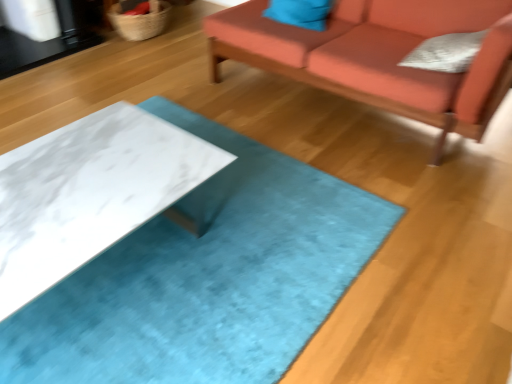
Question: Would you consider matte blue pillow at upper center, which is the second pillow from right to left, to be distant from velvet orange couch at upper right?

Choices:
 (A) no
 (B) yes

Answer: (A)

Question: From a real-world perspective, is matte blue pillow at upper center, which ranks as the first pillow in back-to-front order, under velvet orange couch at upper right?

Choices:
 (A) no
 (B) yes

Answer: (A)

Question: Is matte blue pillow at upper center, placed as the first pillow when sorted from top to bottom, in front of velvet orange couch at upper right?

Choices:
 (A) yes
 (B) no

Answer: (B)

Question: Is matte blue pillow at upper center, which ranks as the first pillow in back-to-front order, to the left of velvet orange couch at upper right from the viewer's perspective?

Choices:
 (A) yes
 (B) no

Answer: (A)

Question: Can you confirm if matte blue pillow at upper center, which is counted as the second pillow, starting from the bottom, is bigger than velvet orange couch at upper right?

Choices:
 (A) no
 (B) yes

Answer: (A)

Question: Considering the positions of point (479, 72) and point (22, 226), is point (479, 72) closer or farther from the camera than point (22, 226)?

Choices:
 (A) closer
 (B) farther

Answer: (B)

Question: Considering their positions, is velvet orange couch at upper right located in front of or behind white marble table at center?

Choices:
 (A) behind
 (B) front

Answer: (A)

Question: From a real-world perspective, relative to white marble table at center, is velvet orange couch at upper right vertically above or below?

Choices:
 (A) below
 (B) above

Answer: (B)

Question: Considering the positions of velvet orange couch at upper right and white marble table at center in the image, is velvet orange couch at upper right wider or thinner than white marble table at center?

Choices:
 (A) thin
 (B) wide

Answer: (A)

Question: Would you say white textured pillow at upper right, which ranks as the 2th pillow in top-to-bottom order, is to the left or to the right of white marble table at center in the picture?

Choices:
 (A) left
 (B) right

Answer: (B)

Question: From a real-world perspective, is white textured pillow at upper right, the 2th pillow positioned from the left, positioned above or below white marble table at center?

Choices:
 (A) below
 (B) above

Answer: (B)

Question: Relative to white marble table at center, is white textured pillow at upper right, which ranks as the 2th pillow in top-to-bottom order, in front or behind?

Choices:
 (A) front
 (B) behind

Answer: (B)

Question: Is white textured pillow at upper right, which ranks as the 2th pillow in top-to-bottom order, wider or thinner than white marble table at center?

Choices:
 (A) thin
 (B) wide

Answer: (A)

Question: Based on their sizes in the image, would you say white marble table at center is bigger or smaller than white textured pillow at upper right, the 1th pillow positioned from the front?

Choices:
 (A) small
 (B) big

Answer: (B)

Question: Is point (84, 142) positioned closer to the camera than point (417, 54)?

Choices:
 (A) farther
 (B) closer

Answer: (B)